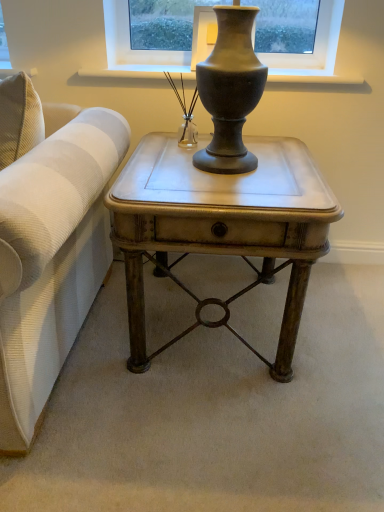
The width and height of the screenshot is (384, 512). I want to click on free space above matte metallic side table at center (from a real-world perspective), so point(215,170).